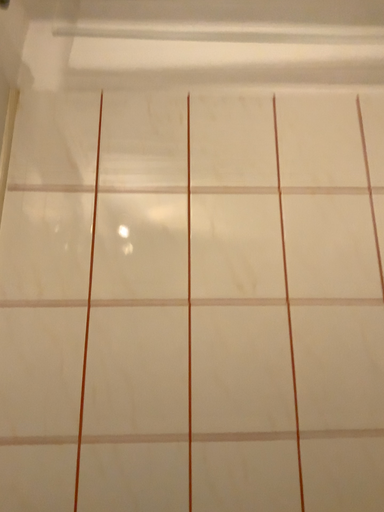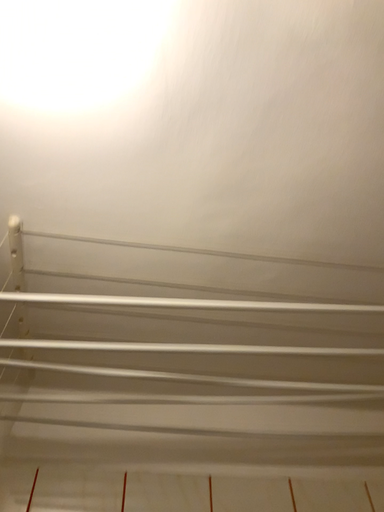
Question: Which way did the camera rotate in the video?

Choices:
 (A) rotated downward
 (B) rotated upward

Answer: (B)